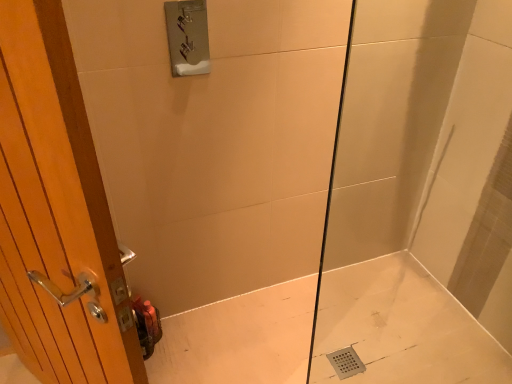
Question: Could you tell me if transparent glass shower door at center is turned towards wooden door at left?

Choices:
 (A) yes
 (B) no

Answer: (B)

Question: Is transparent glass shower door at center wider than wooden door at left?

Choices:
 (A) yes
 (B) no

Answer: (B)

Question: Is transparent glass shower door at center taller than wooden door at left?

Choices:
 (A) yes
 (B) no

Answer: (B)

Question: From a real-world perspective, is transparent glass shower door at center physically above wooden door at left?

Choices:
 (A) no
 (B) yes

Answer: (B)

Question: Is transparent glass shower door at center far away from wooden door at left?

Choices:
 (A) yes
 (B) no

Answer: (A)

Question: Is transparent glass shower door at center not inside wooden door at left?

Choices:
 (A) yes
 (B) no

Answer: (A)

Question: From the image's perspective, does white glossy bath at lower right appear lower than transparent glass shower door at center?

Choices:
 (A) no
 (B) yes

Answer: (B)

Question: Can you confirm if white glossy bath at lower right is smaller than transparent glass shower door at center?

Choices:
 (A) no
 (B) yes

Answer: (A)

Question: From a real-world perspective, is white glossy bath at lower right under transparent glass shower door at center?

Choices:
 (A) yes
 (B) no

Answer: (A)

Question: Considering the relative sizes of white glossy bath at lower right and transparent glass shower door at center in the image provided, is white glossy bath at lower right shorter than transparent glass shower door at center?

Choices:
 (A) yes
 (B) no

Answer: (A)

Question: Are white glossy bath at lower right and transparent glass shower door at center far apart?

Choices:
 (A) yes
 (B) no

Answer: (B)

Question: Is white glossy bath at lower right positioned with its back to transparent glass shower door at center?

Choices:
 (A) no
 (B) yes

Answer: (A)

Question: Is the surface of white glossy bath at lower right in direct contact with wooden door at left?

Choices:
 (A) no
 (B) yes

Answer: (A)